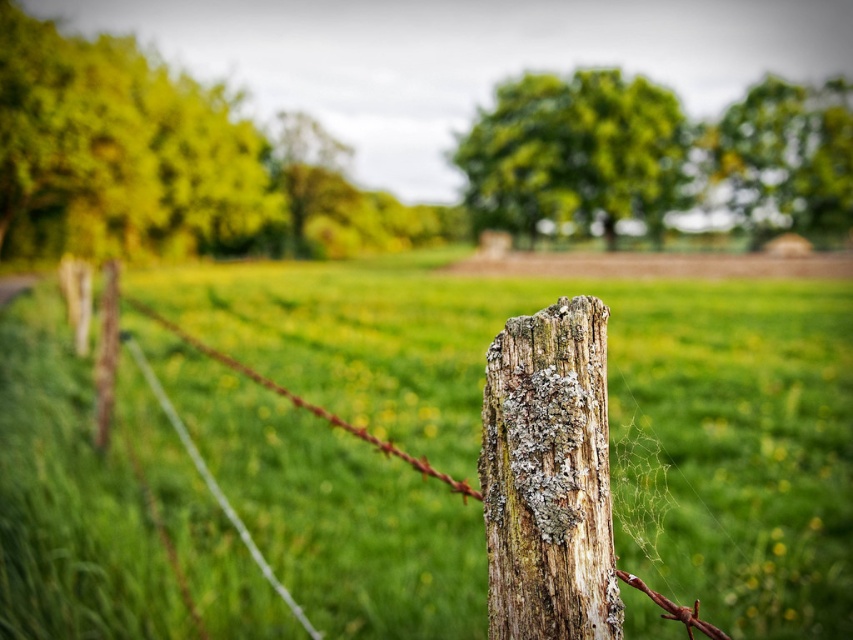
Question: Can you confirm if weathered wood post at center is positioned to the right of green leafy tree at upper right?

Choices:
 (A) yes
 (B) no

Answer: (B)

Question: Considering the real-world distances, which object is closest to the green leafy tree at upper right?

Choices:
 (A) green leafy tree at upper left
 (B) green leafy tree at center

Answer: (B)

Question: Among these points, which one is nearest to the camera?

Choices:
 (A) (701, 134)
 (B) (303, 228)
 (C) (531, 396)

Answer: (C)

Question: Which of the following is the closest to the observer?

Choices:
 (A) weathered wood post at center
 (B) green leafy tree at center
 (C) green leafy tree at upper right
 (D) green leafy tree at upper left

Answer: (A)

Question: Is weathered wood post at center above silver wire at center?

Choices:
 (A) no
 (B) yes

Answer: (B)

Question: Can you confirm if green leafy tree at upper left is positioned above green leafy tree at center?

Choices:
 (A) no
 (B) yes

Answer: (A)